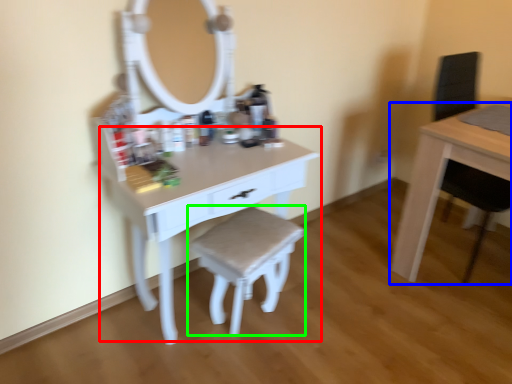
Question: Estimate the real-world distances between objects in this image. Which object is closer to table (highlighted by a red box), table (highlighted by a blue box) or stool (highlighted by a green box)?

Choices:
 (A) table
 (B) stool

Answer: (B)